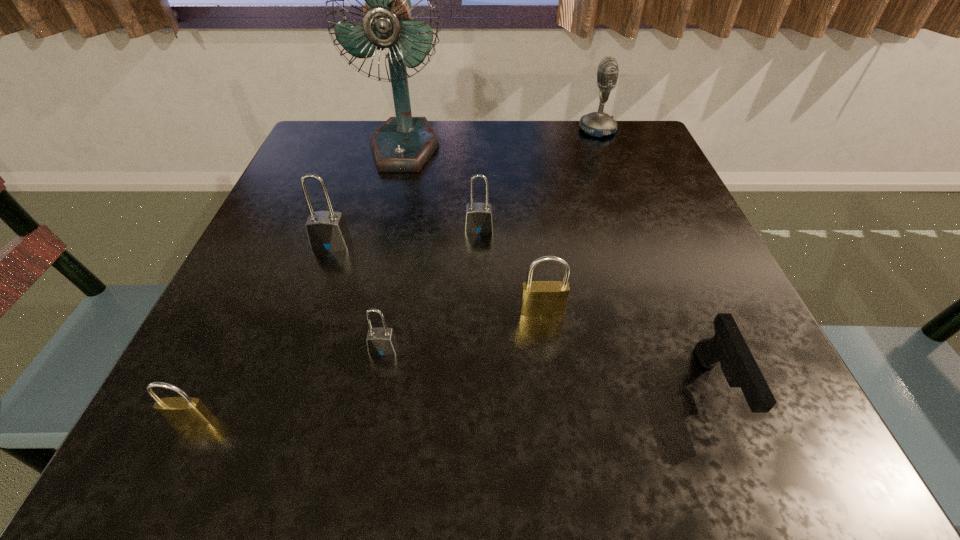
The image size is (960, 540). I want to click on fan, so click(403, 143).

This screenshot has height=540, width=960. Identify the location of blue fan. (403, 143).

Find the location of a particular element. This screenshot has width=960, height=540. microphone is located at coordinates (597, 124).

At what (x,y) coordinates should I click in order to perform the action: click on the fifth nearest object. Please return your answer as a coordinate pair (x, y). The height and width of the screenshot is (540, 960). Looking at the image, I should click on (327, 230).

At what (x,y) coordinates should I click in order to perform the action: click on the second padlock from left to right. Please return your answer as a coordinate pair (x, y). This screenshot has width=960, height=540. Looking at the image, I should click on (327, 230).

You are a GUI agent. You are given a task and a screenshot of the screen. Output one action in this format:
    pyautogui.click(x=<x>, y=<y>)
    Task: Click on the farthest padlock
    This screenshot has height=540, width=960.
    Given the screenshot: What is the action you would take?
    pyautogui.click(x=479, y=220)

Locate an element on the screen. This screenshot has height=540, width=960. the fourth object from right to left is located at coordinates (479, 220).

I want to click on the farther brass padlock, so click(539, 298).

Image resolution: width=960 pixels, height=540 pixels. I want to click on the fifth farthest object, so click(x=539, y=298).

Identify the location of pistol. (727, 347).